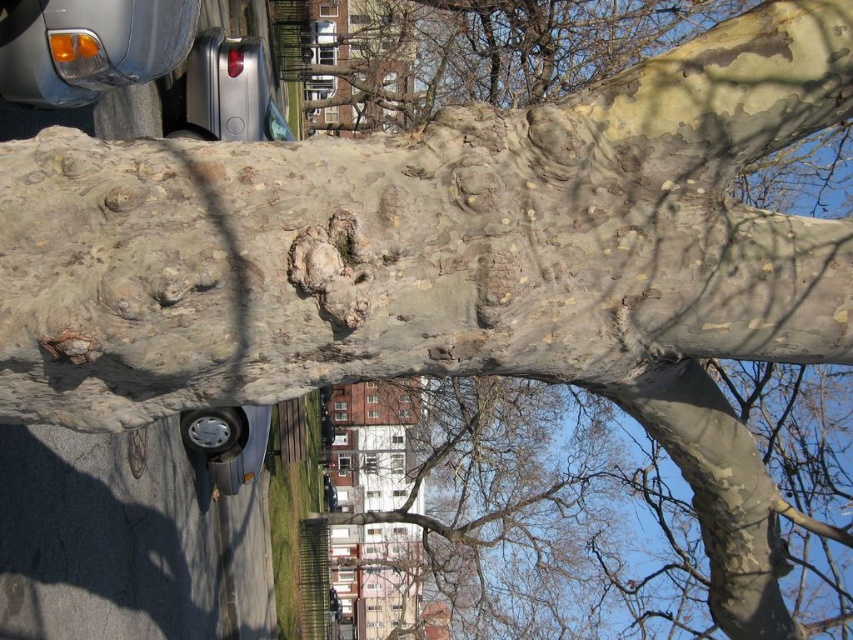
Question: Among these points, which one is nearest to the camera?

Choices:
 (A) (651, 51)
 (B) (228, 426)
 (C) (85, 104)

Answer: (C)

Question: Which point appears farthest from the camera in this image?

Choices:
 (A) (236, 420)
 (B) (10, 64)

Answer: (A)

Question: From the image, what is the correct spatial relationship of leathery bark tree trunk at upper center in relation to metallic gray headlight at upper left?

Choices:
 (A) below
 (B) above

Answer: (B)

Question: Considering the relative positions of leathery bark tree trunk at upper center and shiny silver hubcap at lower center in the image provided, where is leathery bark tree trunk at upper center located with respect to shiny silver hubcap at lower center?

Choices:
 (A) below
 (B) above

Answer: (B)

Question: Is leathery bark tree trunk at upper center to the right of metallic gray headlight at upper left from the viewer's perspective?

Choices:
 (A) no
 (B) yes

Answer: (B)

Question: Which of the following is the farthest from the observer?

Choices:
 (A) shiny silver hubcap at lower center
 (B) metallic gray headlight at upper left

Answer: (A)